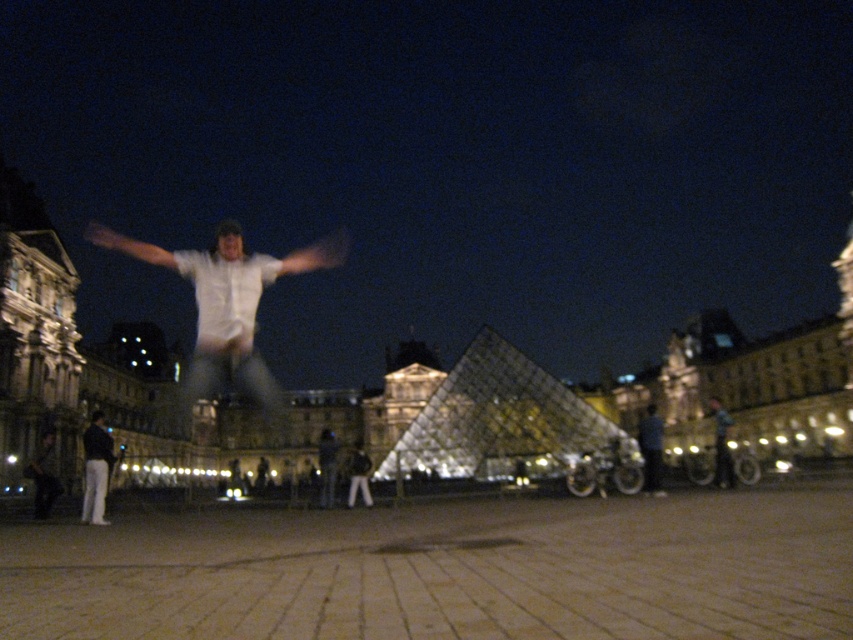
In the scene shown: Does white matte shirt at center appear over dark blue jeans at lower left?

Indeed, white matte shirt at center is positioned over dark blue jeans at lower left.

In the scene shown: Who is more distant from viewer, [258,273] or [100,468]?

The point [258,273] is behind.

The height and width of the screenshot is (640, 853). What are the coordinates of `white matte shirt at center` in the screenshot? It's located at 227,301.

At what (x,y) coordinates should I click in order to perform the action: click on white matte shirt at center. Please return your answer as a coordinate pair (x, y). The height and width of the screenshot is (640, 853). Looking at the image, I should click on (227, 301).